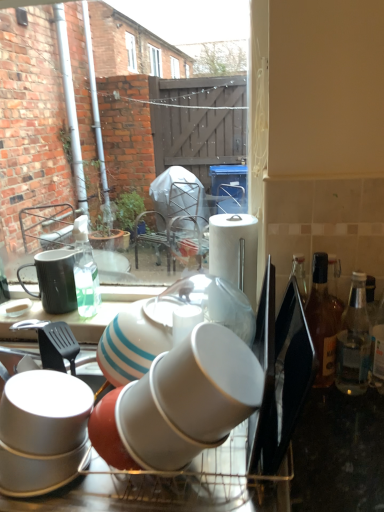
Question: Which direction should I rotate to look at white glossy cup at center, placed as the 2th tableware when sorted from left to right, — up or down?

Choices:
 (A) up
 (B) down

Answer: (B)

Question: Considering the relative positions of white glossy cups at center and white glossy cup at lower left in the image provided, is white glossy cups at center to the right of white glossy cup at lower left from the viewer's perspective?

Choices:
 (A) yes
 (B) no

Answer: (A)

Question: Is white glossy cups at center not close to white glossy cup at lower left?

Choices:
 (A) yes
 (B) no

Answer: (B)

Question: Does white glossy cups at center appear on the left side of white glossy cup at lower left?

Choices:
 (A) no
 (B) yes

Answer: (A)

Question: From the image's perspective, does white glossy cups at center appear lower than white glossy cup at lower left?

Choices:
 (A) no
 (B) yes

Answer: (B)

Question: Does white glossy cups at center have a smaller size compared to white glossy cup at lower left?

Choices:
 (A) no
 (B) yes

Answer: (A)

Question: Considering the relative sizes of white glossy cups at center and white glossy cup at lower left in the image provided, is white glossy cups at center thinner than white glossy cup at lower left?

Choices:
 (A) yes
 (B) no

Answer: (B)

Question: Does white glossy cups at center touch clear glass bottle at right, the first bottle in the right-to-left sequence?

Choices:
 (A) yes
 (B) no

Answer: (B)

Question: From the image's perspective, would you say white glossy cups at center is shown under clear glass bottle at right, which is the second bottle in left-to-right order?

Choices:
 (A) yes
 (B) no

Answer: (A)

Question: Is white glossy cups at center looking in the opposite direction of clear glass bottle at right, the first bottle in the right-to-left sequence?

Choices:
 (A) yes
 (B) no

Answer: (B)

Question: From a real-world perspective, is white glossy cups at center on top of clear glass bottle at right, the first bottle in the right-to-left sequence?

Choices:
 (A) yes
 (B) no

Answer: (B)

Question: Is white glossy cups at center not close to clear glass bottle at right, which is the second bottle in left-to-right order?

Choices:
 (A) yes
 (B) no

Answer: (B)

Question: Is white glossy cups at center at the right side of clear glass bottle at right, the first bottle in the right-to-left sequence?

Choices:
 (A) yes
 (B) no

Answer: (B)

Question: Does clear glass bottle at right, the first bottle in the right-to-left sequence, appear on the right side of white glossy cup at center, the 1th tableware viewed from the front?

Choices:
 (A) no
 (B) yes

Answer: (B)